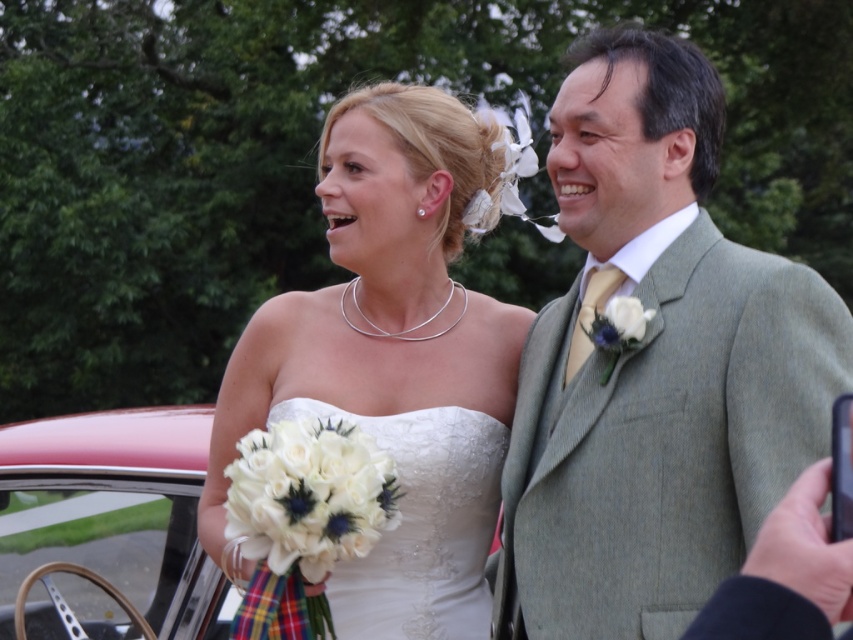
You are a photographer trying to capture the perfect shot of the wedding couple. You notice two points in the image at coordinates point (335, 404) and point (485, 420). Which point is closer to you?

Point (335, 404) is closer to the viewer than point (485, 420).

You are a photographer at a wedding and need to adjust lighting to ensure both the white satin dress at center and the white lace dress at center are visible. Since one is covering part of the other, which dress should you focus the light on to highlight the details of both?

The white satin dress at center is positioned over white lace dress at center. To highlight details of both, focus light on the white satin dress at center to prevent it from overshadowing the lace dress underneath while ensuring the lace patterns remain visible.